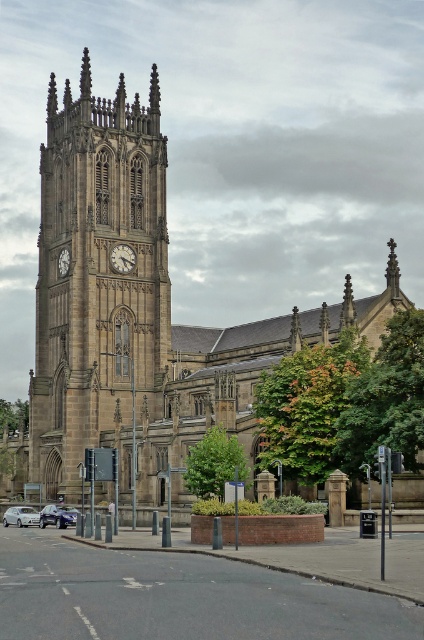
You are an architect planning to install a new decorative element on the church facade. You have two options for placement locations based on the existing stone clock tower at left and white marble clock at center. Which object has a greater horizontal space available for placement?

The stone clock tower at left has a greater horizontal space available for placement since its width surpasses that of the white marble clock at center.